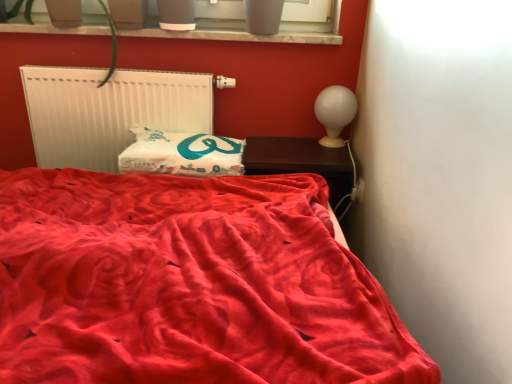
Question: From the image's perspective, is velvet red bed at center above white matte radiator at upper left?

Choices:
 (A) no
 (B) yes

Answer: (A)

Question: Is the depth of velvet red bed at center greater than that of white matte radiator at upper left?

Choices:
 (A) no
 (B) yes

Answer: (A)

Question: Is velvet red bed at center oriented away from white matte radiator at upper left?

Choices:
 (A) yes
 (B) no

Answer: (B)

Question: From a real-world perspective, is velvet red bed at center physically above white matte radiator at upper left?

Choices:
 (A) yes
 (B) no

Answer: (B)

Question: Is velvet red bed at center to the left of white matte radiator at upper left from the viewer's perspective?

Choices:
 (A) yes
 (B) no

Answer: (B)

Question: In the image, is white soft pillow at center positioned in front of or behind dark wood nightstand at right?

Choices:
 (A) front
 (B) behind

Answer: (A)

Question: Visually, is white soft pillow at center positioned to the left or to the right of dark wood nightstand at right?

Choices:
 (A) left
 (B) right

Answer: (A)

Question: In terms of height, does white soft pillow at center look taller or shorter compared to dark wood nightstand at right?

Choices:
 (A) short
 (B) tall

Answer: (B)

Question: Is white soft pillow at center inside or outside of dark wood nightstand at right?

Choices:
 (A) inside
 (B) outside

Answer: (B)

Question: From their relative heights in the image, would you say velvet red bed at center is taller or shorter than white soft pillow at center?

Choices:
 (A) tall
 (B) short

Answer: (A)

Question: Considering the positions of velvet red bed at center and white soft pillow at center in the image, is velvet red bed at center bigger or smaller than white soft pillow at center?

Choices:
 (A) small
 (B) big

Answer: (B)

Question: From a real-world perspective, is velvet red bed at center above or below white soft pillow at center?

Choices:
 (A) below
 (B) above

Answer: (A)

Question: Would you say velvet red bed at center is to the left or to the right of white soft pillow at center in the picture?

Choices:
 (A) left
 (B) right

Answer: (A)

Question: Looking at the image, does white glossy table lamp at upper right seem bigger or smaller compared to white matte radiator at upper left?

Choices:
 (A) big
 (B) small

Answer: (B)

Question: From a real-world perspective, is white glossy table lamp at upper right above or below white matte radiator at upper left?

Choices:
 (A) below
 (B) above

Answer: (B)